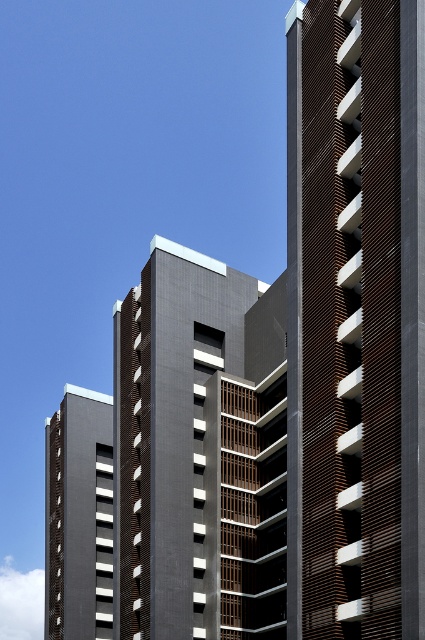
Does brown wooden slats at center appear on the right side of dark gray concrete building at center?

Correct, you'll find brown wooden slats at center to the right of dark gray concrete building at center.

Looking at this image, does brown wooden slats at center lie behind dark gray concrete building at center?

No, it is not.

Where is `brown wooden slats at center`? The width and height of the screenshot is (425, 640). brown wooden slats at center is located at coordinates (359, 310).

Between point (402, 556) and point (101, 560), which one is positioned behind?

The point (101, 560) is behind.

Is point (353, 20) farther from viewer compared to point (78, 536)?

That is False.

Identify the location of brown wooden slats at center. (359, 310).

The width and height of the screenshot is (425, 640). Identify the location of brown wooden slats at center. (359, 310).

Between dark gray concrete building at center and dark gray concrete building at lower left, which one has less height?

dark gray concrete building at lower left is shorter.

You are a GUI agent. You are given a task and a screenshot of the screen. Output one action in this format:
    pyautogui.click(x=<x>, y=<y>)
    Task: Click on the dark gray concrete building at center
    The image size is (425, 640).
    Given the screenshot: What is the action you would take?
    pyautogui.click(x=198, y=452)